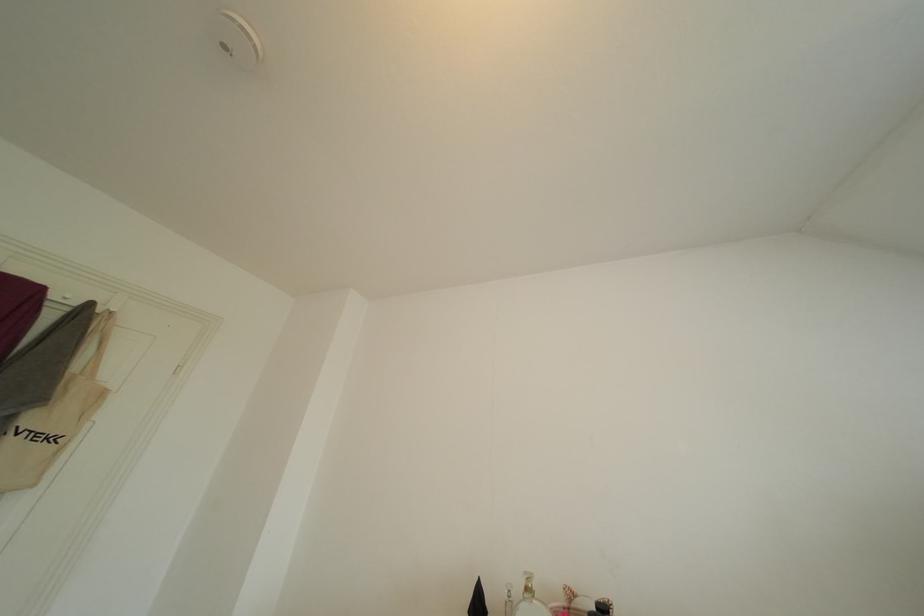
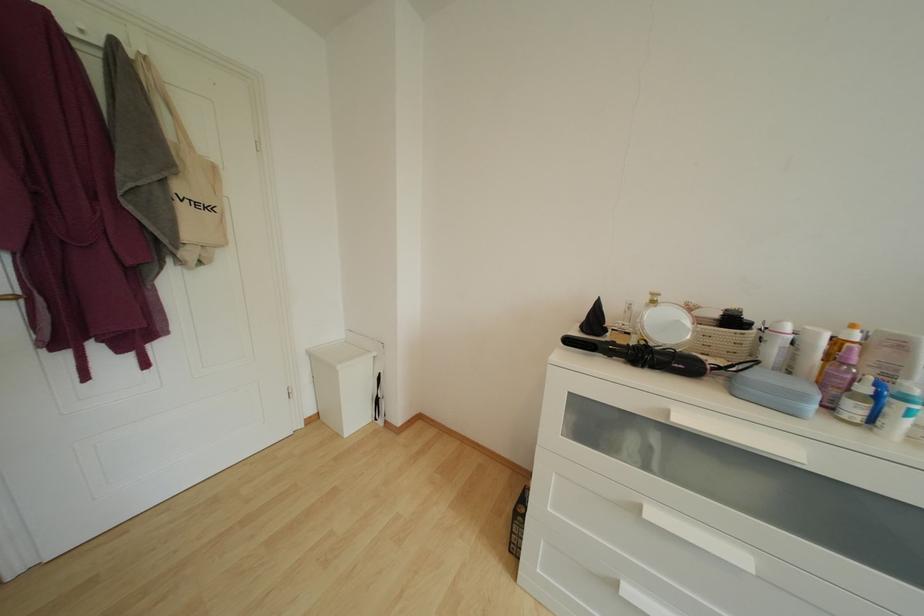
Question: Based on the continuous images, in which direction is the camera rotating? Reply with the corresponding letter.

Choices:
 (A) Left
 (B) Right
 (C) Up
 (D) Down

Answer: (D)